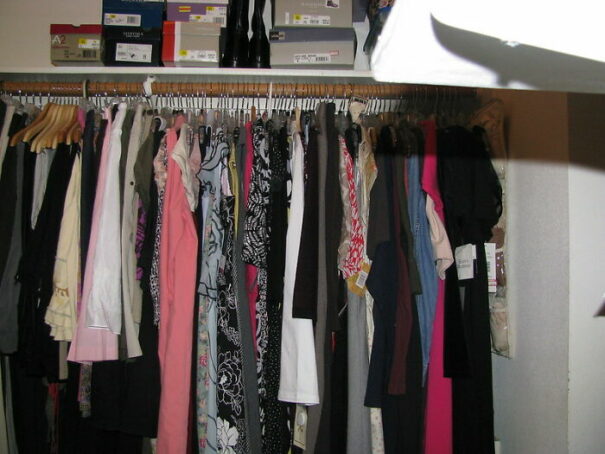
What are the coordinates of `shoebox on far left` in the screenshot? It's located at (79, 42).